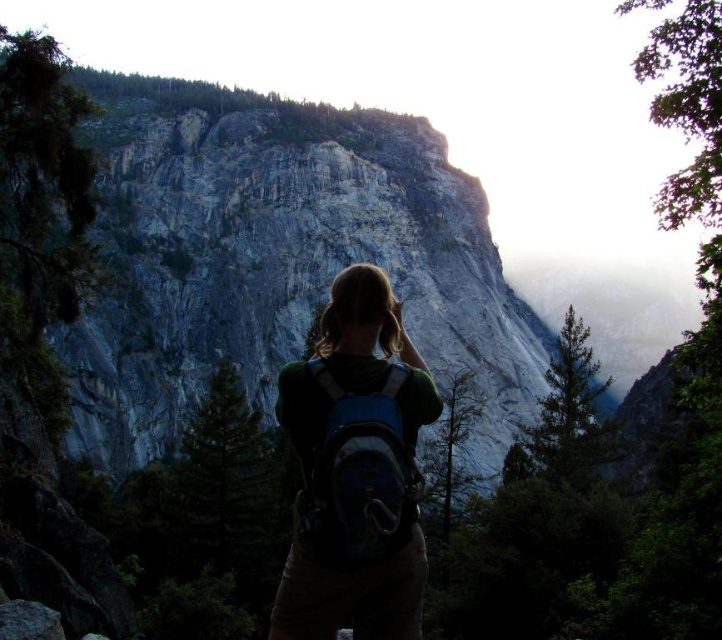
You are a hiker planning to climb the cliff. You have a green fabric backpack at center. Where is the backpack positioned relative to your starting point at the base of the cliff?

The green fabric backpack at center is located at point (355, 472), which is to the right and slightly above the center of the image, so it is positioned to the right side of your starting point at the base of the cliff.